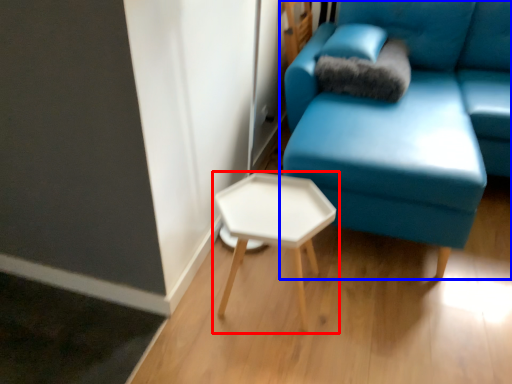
Question: Which object is closer to the camera taking this photo, table (highlighted by a red box) or studio couch (highlighted by a blue box)?

Choices:
 (A) table
 (B) studio couch

Answer: (B)